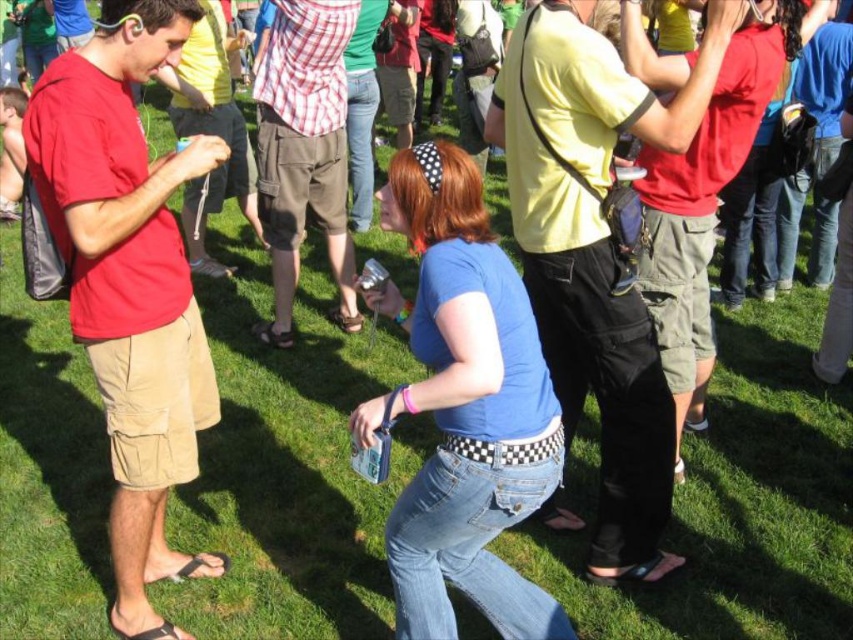
Question: Among these objects, which one is farthest from the camera?

Choices:
 (A) yellow cotton shirt at center
 (B) matte khaki shorts at left
 (C) checkered fabric shirt at center

Answer: (C)

Question: Can you confirm if matte khaki shorts at left is positioned above yellow cotton shirt at center?

Choices:
 (A) yes
 (B) no

Answer: (B)

Question: Can you confirm if yellow cotton shirt at center is wider than checkered fabric shirt at center?

Choices:
 (A) no
 (B) yes

Answer: (B)

Question: Is yellow cotton shirt at center wider than checkered fabric shirt at center?

Choices:
 (A) yes
 (B) no

Answer: (A)

Question: Which point appears farthest from the camera in this image?

Choices:
 (A) (154, 426)
 (B) (323, 180)
 (C) (631, 406)

Answer: (B)

Question: Which point appears farthest from the camera in this image?

Choices:
 (A) (291, 156)
 (B) (120, 65)

Answer: (A)